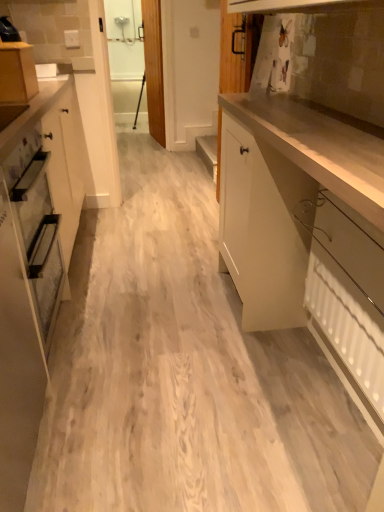
What are the coordinates of `free area below glossy white cabinet at right, which appears as the first cabinetry when viewed from the right (from a real-world perspective)` in the screenshot? It's located at (308, 391).